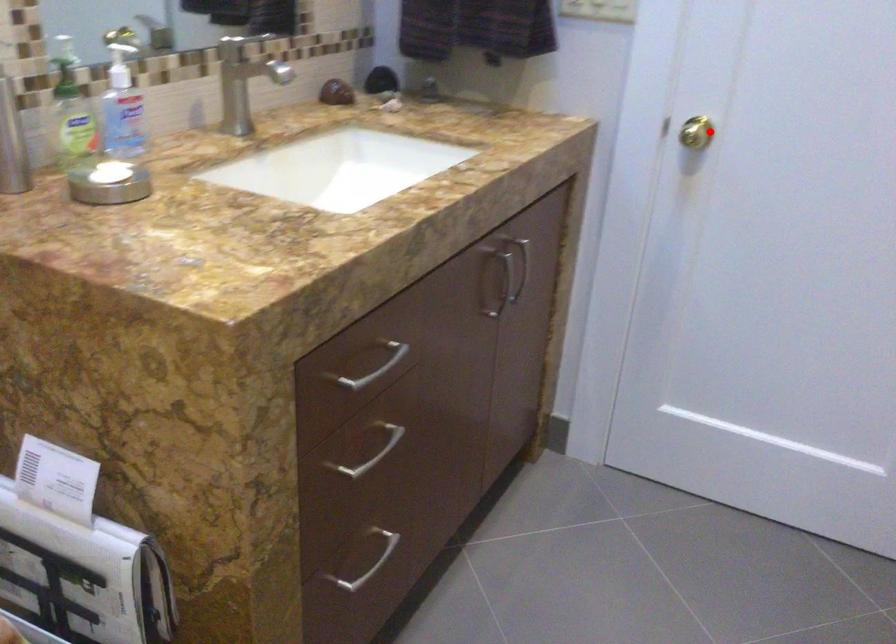
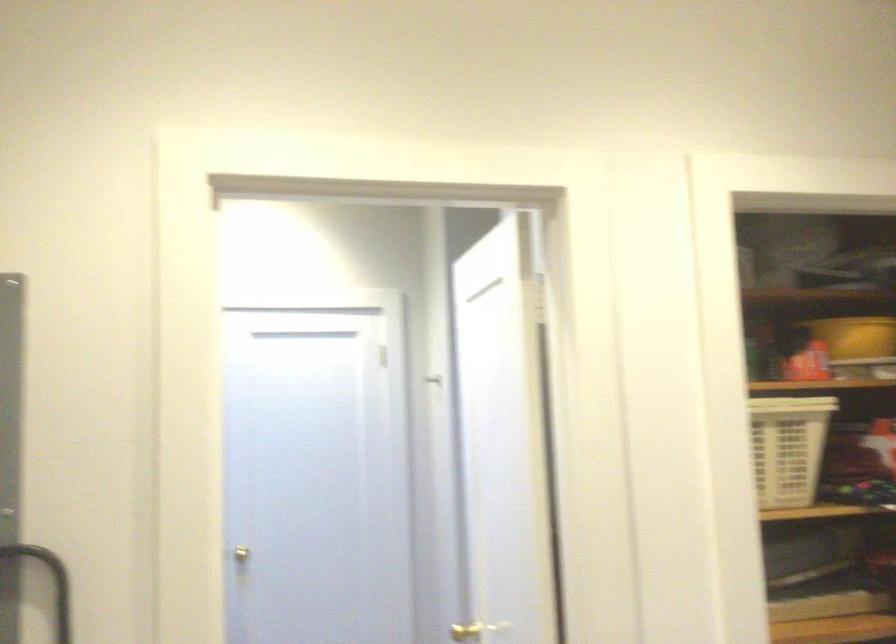
Question: I am providing you with two images of the same scene from different viewpoints. In image1, a red point is highlighted. Considering the same 3D point in image2, which of the following is correct?

Choices:
 (A) It is closer
 (B) It is farther

Answer: (B)